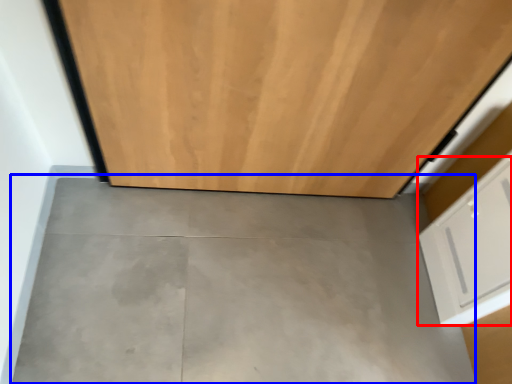
Question: Which object is further to the camera taking this photo, drawer (highlighted by a red box) or concrete (highlighted by a blue box)?

Choices:
 (A) drawer
 (B) concrete

Answer: (B)